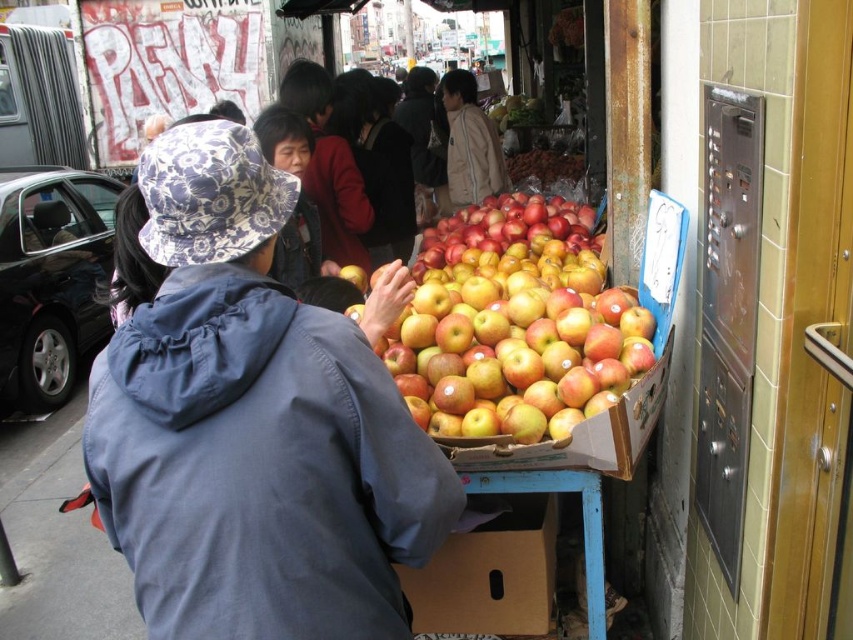
Does matte black jacket at center appear over light brown jacket at center?

Incorrect, matte black jacket at center is not positioned above light brown jacket at center.

Consider the image. Which of these two, matte black jacket at center or light brown jacket at center, stands shorter?

light brown jacket at center

Consider the image. Measure the distance between point (375, 99) and camera.

A distance of 16.91 feet exists between point (375, 99) and camera.

Identify the location of matte black jacket at center. The width and height of the screenshot is (853, 640). (384, 168).

Between glossy red apples at center and matte black jacket at center, which one has less height?

Standing shorter between the two is glossy red apples at center.

Measure the distance between point [518,378] and camera.

Point [518,378] is 5.90 feet from camera.

At what (x,y) coordinates should I click in order to perform the action: click on glossy red apples at center. Please return your answer as a coordinate pair (x, y). Looking at the image, I should click on (512, 326).

Is the position of glossy red apples at center more distant than that of brown cardboard box at lower center?

No, glossy red apples at center is in front of brown cardboard box at lower center.

Who is positioned more to the right, glossy red apples at center or brown cardboard box at lower center?

glossy red apples at center is more to the right.

Is point (491, 321) farther from camera compared to point (538, 531)?

No, it is not.

Locate an element on the screen. The width and height of the screenshot is (853, 640). glossy red apples at center is located at coordinates (512, 326).